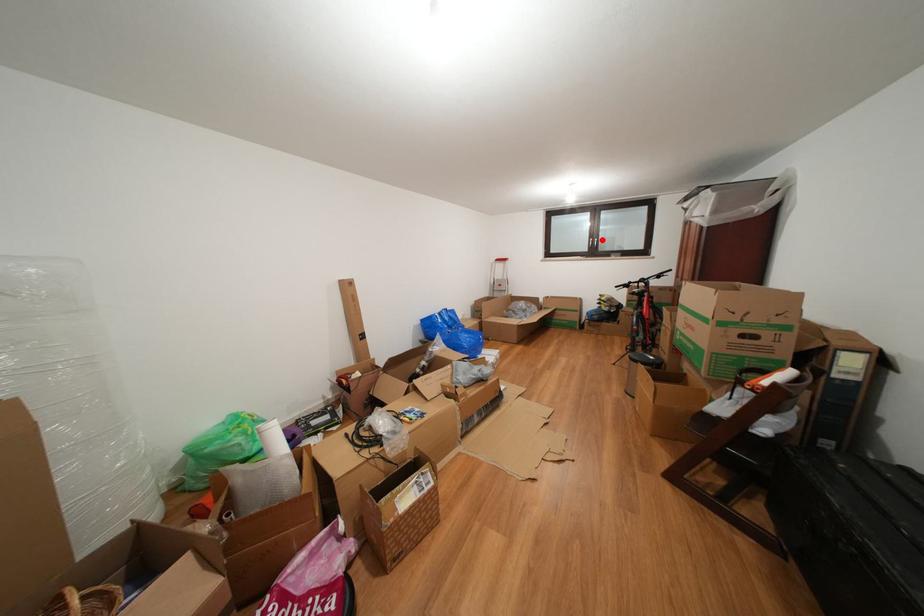
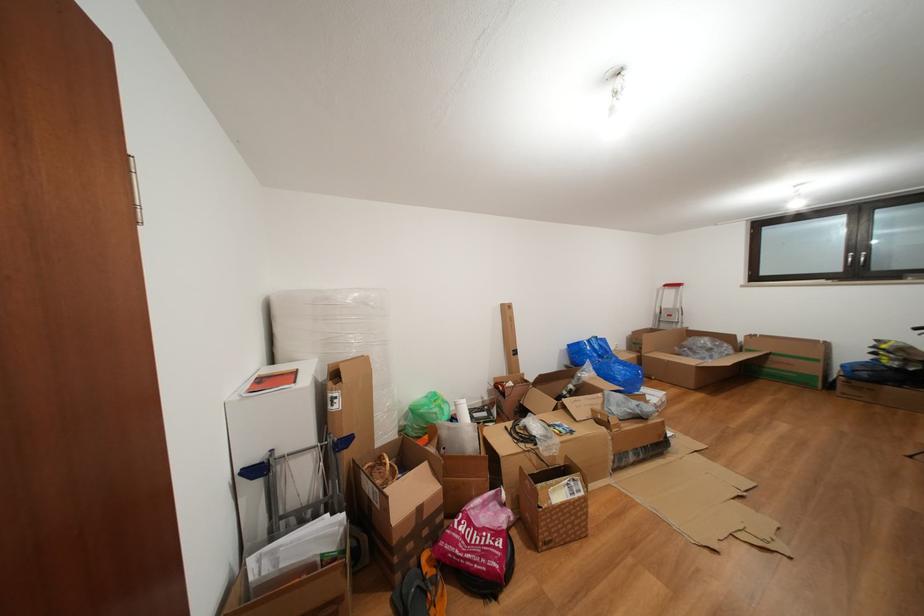
Question: I am providing you with two images of the same scene from different viewpoints. Image1 has a red point marked. In image2, the corresponding 3D location appears at what relative position? Reply with the corresponding letter.

Choices:
 (A) Closer
 (B) Farther

Answer: (B)